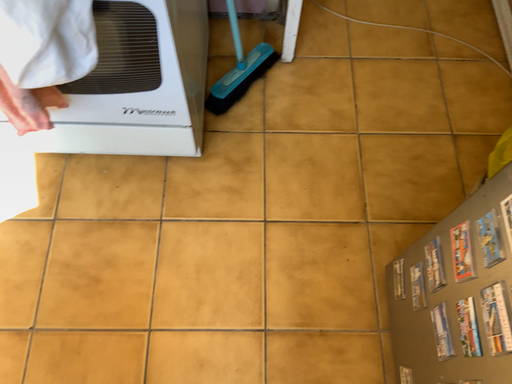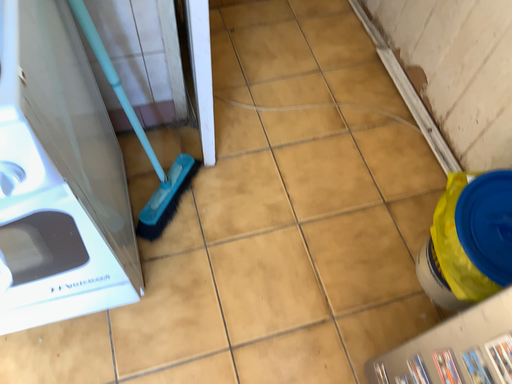
Question: Which way did the camera rotate in the video?

Choices:
 (A) rotated right
 (B) rotated left

Answer: (A)